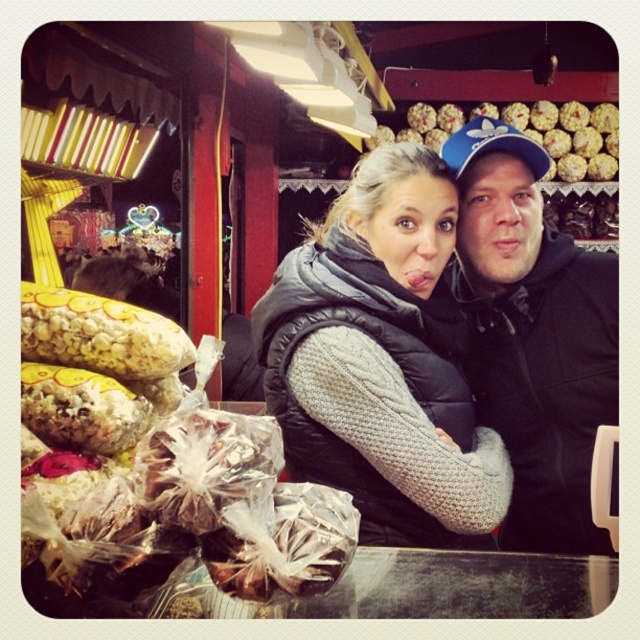
Question: Which point is closer to the camera taking this photo?

Choices:
 (A) 310,246
 (B) 100,481
 (C) 611,134

Answer: (B)

Question: Based on their relative distances, which object is farther from the shiny metallic popcorn at left?

Choices:
 (A) black hoodie at center
 (B) shiny chocolate truffle at upper right
 (C) gray quilted vest at center

Answer: (B)

Question: Does shiny metallic popcorn at left appear on the right side of black hoodie at center?

Choices:
 (A) no
 (B) yes

Answer: (A)

Question: Does gray quilted vest at center come in front of shiny chocolate truffle at upper right?

Choices:
 (A) yes
 (B) no

Answer: (A)

Question: Can you confirm if gray quilted vest at center is positioned below shiny metallic popcorn at left?

Choices:
 (A) yes
 (B) no

Answer: (B)

Question: Which point is closer to the camera?

Choices:
 (A) (182, 540)
 (B) (454, 196)
 (C) (564, 381)

Answer: (A)